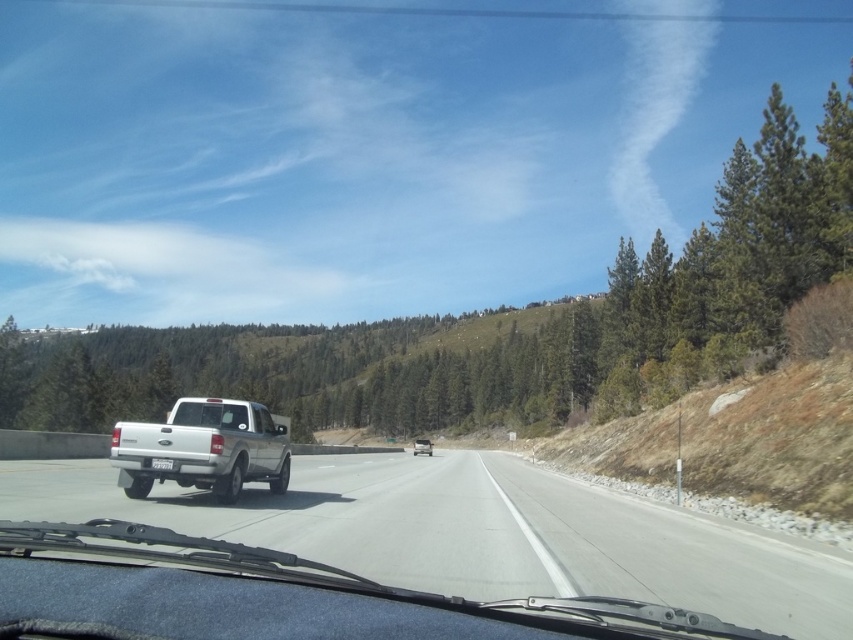
Question: Which point appears closest to the camera in this image?

Choices:
 (A) (210, 413)
 (B) (190, 502)
 (C) (125, 442)

Answer: (C)

Question: Does white glossy truck at center appear on the left side of clear glass windshield at center?

Choices:
 (A) no
 (B) yes

Answer: (A)

Question: Based on their relative distances, which object is farther from the clear glass windshield at center?

Choices:
 (A) white matte pickup truck at center
 (B) white glossy truck at center
 (C) white matte truck at center

Answer: (C)

Question: Can you confirm if white glossy truck at center is positioned below white matte pickup truck at center?

Choices:
 (A) yes
 (B) no

Answer: (A)

Question: Can you confirm if white glossy truck at center is positioned to the right of white matte pickup truck at center?

Choices:
 (A) yes
 (B) no

Answer: (A)

Question: Which of these objects is positioned farthest from the white glossy truck at center?

Choices:
 (A) white matte pickup truck at center
 (B) white matte truck at center

Answer: (B)